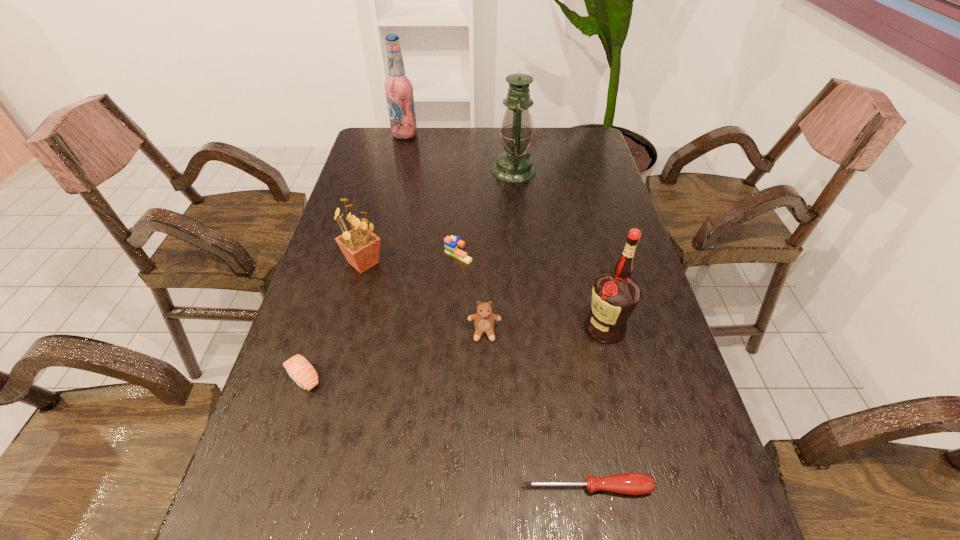
The height and width of the screenshot is (540, 960). What are the coordinates of `vacant space at the right edge of the desktop` in the screenshot? It's located at [x=592, y=219].

This screenshot has width=960, height=540. I want to click on free space at the far left corner of the desktop, so click(396, 146).

This screenshot has width=960, height=540. I want to click on free space between the left alcohol and the sixth tallest object, so click(x=432, y=194).

You are a GUI agent. You are given a task and a screenshot of the screen. Output one action in this format:
    pyautogui.click(x=<x>, y=<y>)
    Task: Click on the vacant area between the second farthest object and the sunflower
    
    Given the screenshot: What is the action you would take?
    pyautogui.click(x=439, y=217)

Locate an element on the screen. The height and width of the screenshot is (540, 960). free area in between the teddy bear and the fourth tallest object is located at coordinates (424, 298).

You are a GUI agent. You are given a task and a screenshot of the screen. Output one action in this format:
    pyautogui.click(x=<x>, y=<y>)
    Task: Click on the free space between the screwdriver and the sunflower
    This screenshot has width=960, height=540.
    Given the screenshot: What is the action you would take?
    pyautogui.click(x=475, y=375)

The image size is (960, 540). I want to click on free point between the Lego and the sushi, so click(x=380, y=315).

Identify the location of vacant area that lies between the fifth shortest object and the sushi. (333, 320).

Identify the location of free area in between the sunflower and the third shortest object. The width and height of the screenshot is (960, 540). (411, 258).

Locate an element on the screen. This screenshot has width=960, height=540. free space that is in between the seventh nearest object and the screwdriver is located at coordinates (550, 329).